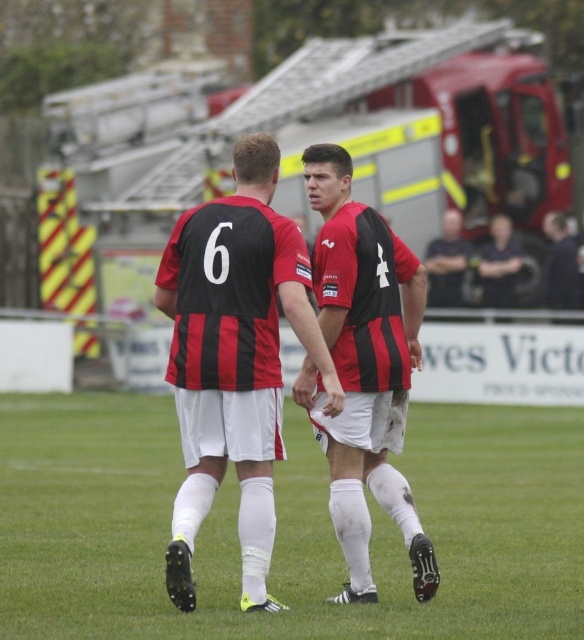
You are a photographer trying to capture both the dark blue shirt at right and the dark blue jersey at center in a single shot. Based on their sizes in the image, which one should you focus on to ensure both are clearly visible?

The dark blue shirt at right occupies less space than the dark blue jersey at center, so focusing on the larger dark blue jersey at center would allow both to be clearly visible in the photo.

You are a soccer player standing on the field and you want to pass the ball to your teammate who is near the matte black jersey at center. However, there is a red metallic fire truck at upper center blocking your view. Which direction should you move to get a clear path to your teammate?

The red metallic fire truck at upper center is on the right side of the matte black jersey at center, so you should move to the left side of the fire truck to get a clear path to your teammate near the matte black jersey at center.

You are a drone operator trying to capture a photo of the soccer players. The drone is currently at the red metallic fire truck at upper center. To get a clear shot, you need to move the drone 0.1 units to the right and 0.1 units down from its current position. What object will the drone be closest to after moving?

After moving 0.1 units to the right and 0.1 units down from the red metallic fire truck at upper center located at point (x=352, y=136), the new coordinates would be approximately (x=411, y=200). Since the soccer players are positioned on the grassy field below the fire truck, the drone would be closest to the soccer players.